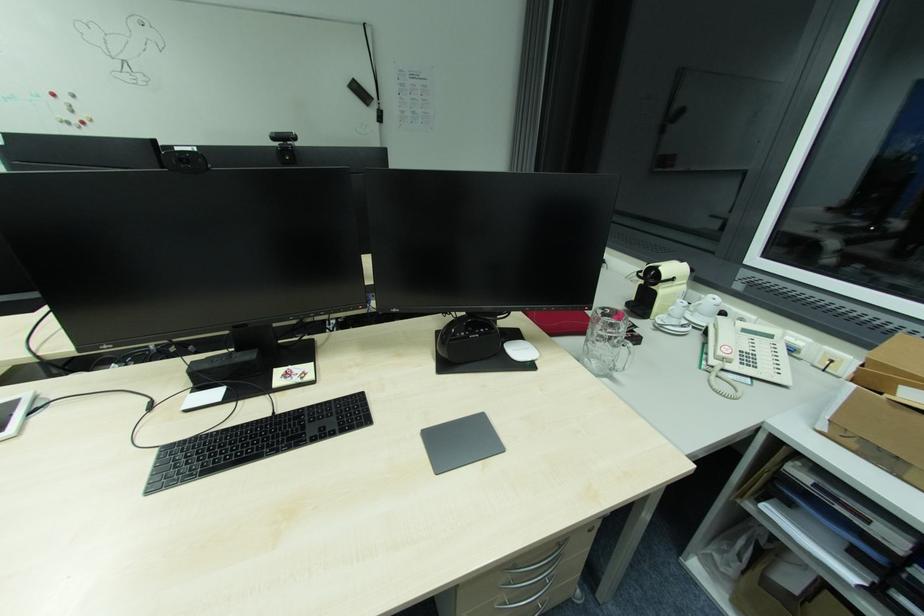
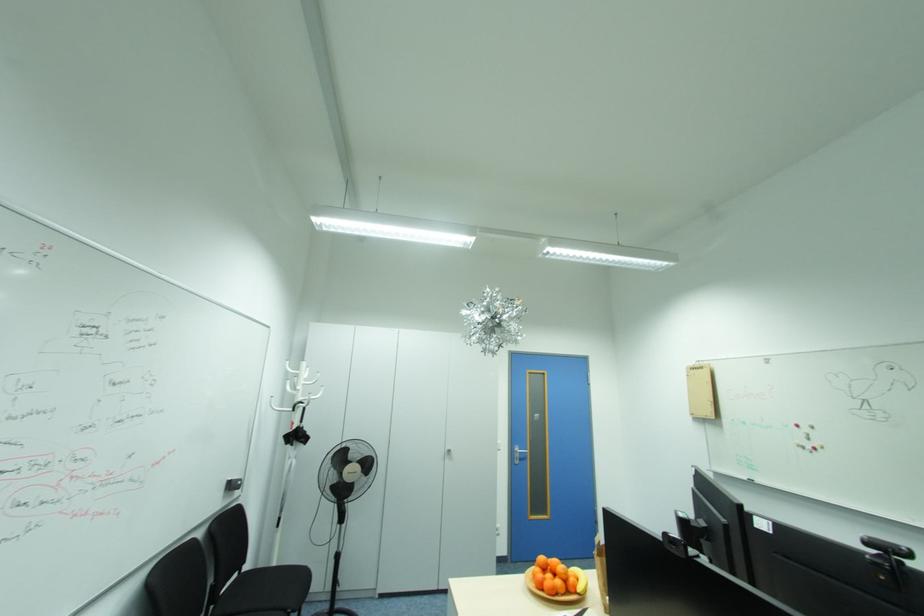
Question: The camera is either moving clockwise (left) or counter-clockwise (right) around the object. The first image is from the beginning of the video and the second image is from the end. Is the camera moving left or right when shooting the video?

Choices:
 (A) Left
 (B) Right

Answer: (B)